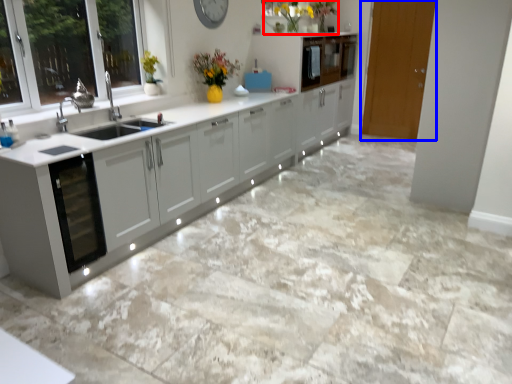
Question: Among these objects, which one is nearest to the camera, floral arrangement (highlighted by a red box) or door (highlighted by a blue box)?

Choices:
 (A) floral arrangement
 (B) door

Answer: (A)